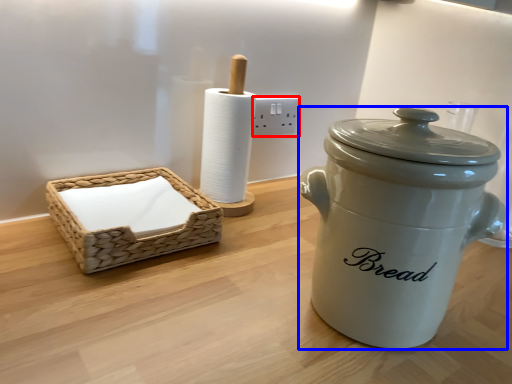
Question: Which object appears farthest to the camera in this image, electric outlet (highlighted by a red box) or crock pot (highlighted by a blue box)?

Choices:
 (A) electric outlet
 (B) crock pot

Answer: (A)